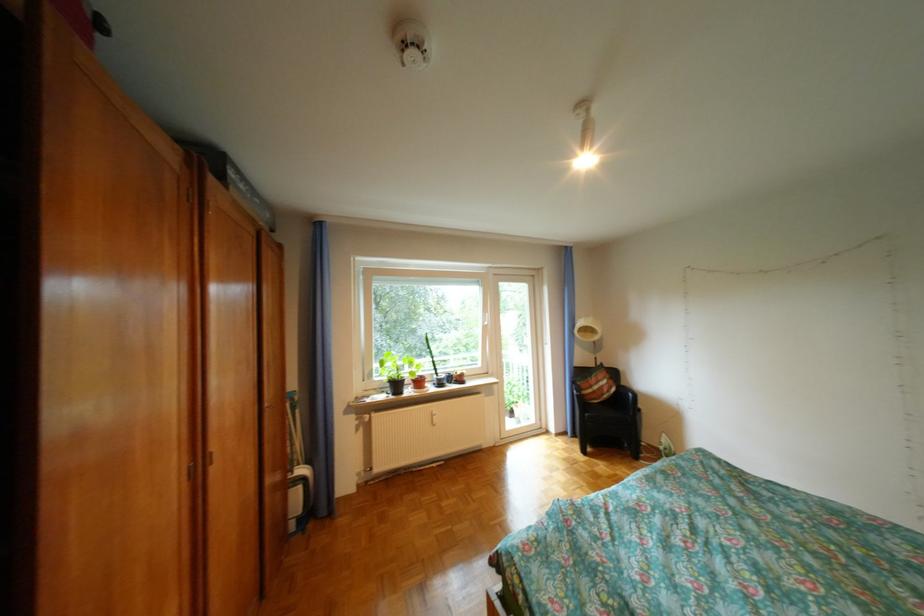
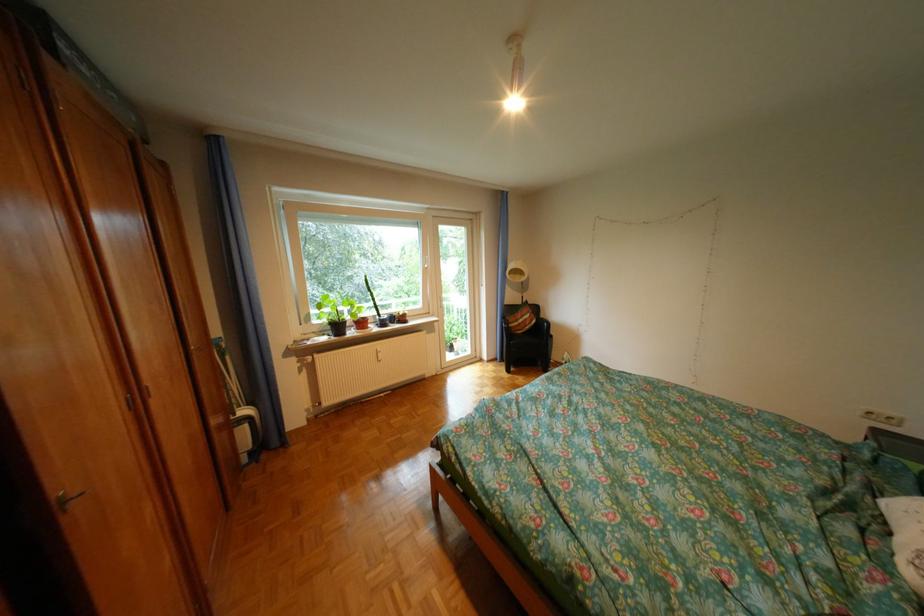
Question: The images are taken continuously from a first-person perspective. In which direction are you moving?

Choices:
 (A) Left
 (B) Right
 (C) Forward
 (D) Backward

Answer: (D)